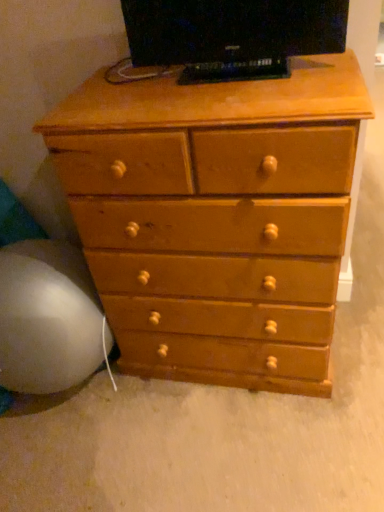
You are a GUI agent. You are given a task and a screenshot of the screen. Output one action in this format:
    pyautogui.click(x=<x>, y=<y>)
    Task: Click on the free space above light brown wood chest of drawers at center (from a real-world perspective)
    
    Given the screenshot: What is the action you would take?
    pyautogui.click(x=173, y=83)